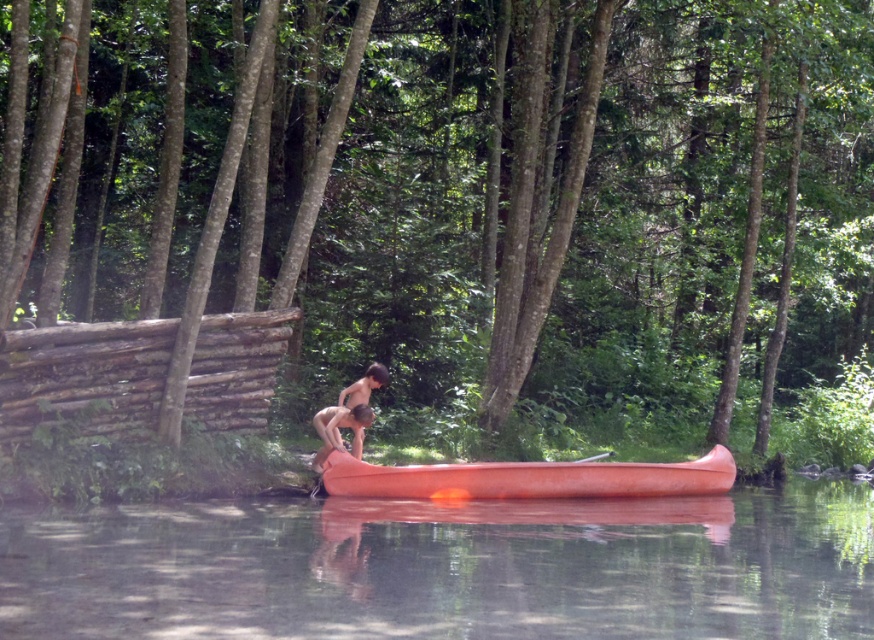
Question: Which object is the closest to the orange smooth canoe at center?

Choices:
 (A) smooth skin person at center
 (B) smooth orange canoe at center

Answer: (B)

Question: Does orange smooth canoe at center have a smaller size compared to smooth orange canoe at center?

Choices:
 (A) no
 (B) yes

Answer: (A)

Question: Is orange smooth canoe at center further to camera compared to smooth orange canoe at center?

Choices:
 (A) no
 (B) yes

Answer: (B)

Question: Among these points, which one is nearest to the camera?

Choices:
 (A) (334, 429)
 (B) (417, 481)
 (C) (134, 628)
 (D) (370, 385)

Answer: (C)

Question: Is transparent water at lower center closer to camera compared to smooth orange canoe at center?

Choices:
 (A) no
 (B) yes

Answer: (B)

Question: Which object appears closest to the camera in this image?

Choices:
 (A) smooth orange canoe at center
 (B) orange smooth canoe at center
 (C) smooth skin person at center
 (D) transparent water at lower center

Answer: (D)